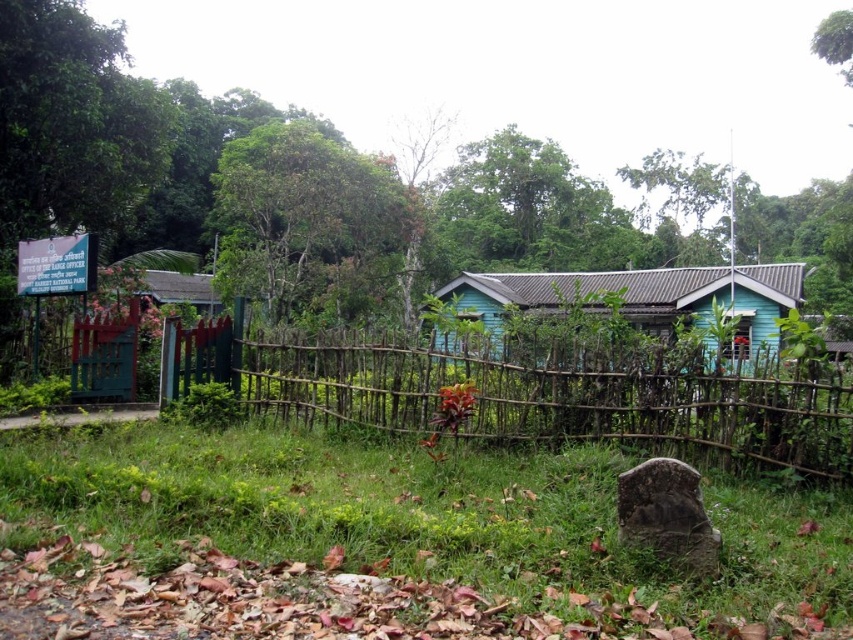
Question: In this image, where is brown wooden fence at center located relative to blue wooden hut at center?

Choices:
 (A) left
 (B) right

Answer: (A)

Question: Can you confirm if green grass at center is positioned to the left of brown wooden fence at center?

Choices:
 (A) yes
 (B) no

Answer: (A)

Question: Which of the following is the farthest from the observer?

Choices:
 (A) (238, 548)
 (B) (474, 412)

Answer: (B)

Question: Does green grass at center have a greater width compared to blue wooden hut at center?

Choices:
 (A) no
 (B) yes

Answer: (A)

Question: Which object is positioned farthest from the brown wooden fence at center?

Choices:
 (A) green grass at center
 (B) blue wooden hut at center

Answer: (B)

Question: Which of the following is the closest to the observer?

Choices:
 (A) (451, 296)
 (B) (175, 474)
 (C) (486, 422)

Answer: (B)